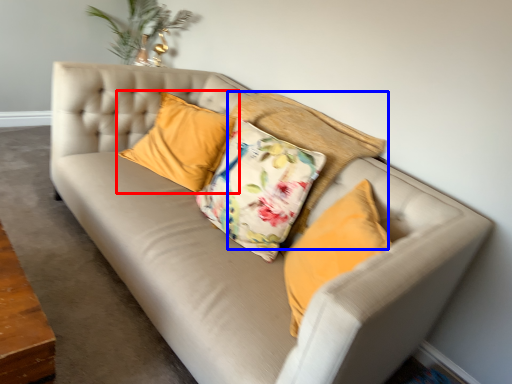
Question: Which of the following is the farthest to the observer, pillow (highlighted by a red box) or pillow (highlighted by a blue box)?

Choices:
 (A) pillow
 (B) pillow

Answer: (A)